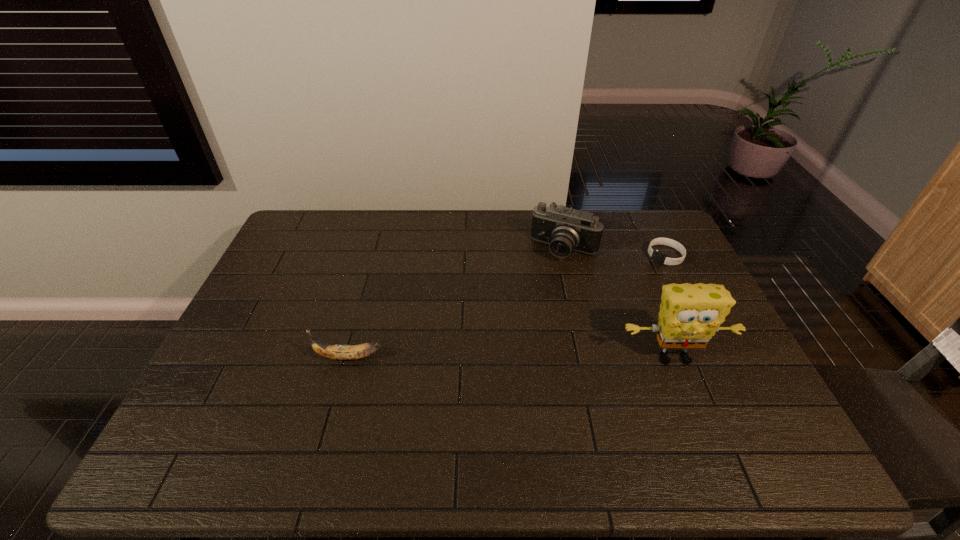
This screenshot has width=960, height=540. I want to click on vacant space at the near edge of the desktop, so click(630, 413).

The width and height of the screenshot is (960, 540). In the image, there is a desktop. What are the coordinates of `vacant space at the left edge` in the screenshot? It's located at coord(241,345).

In the image, there is a desktop. Where is `vacant space at the far left corner`? This screenshot has height=540, width=960. vacant space at the far left corner is located at coordinates (303, 233).

Identify the location of free region at the far right corner of the desktop. The image size is (960, 540). (638, 230).

I want to click on vacant space at the near right corner, so click(767, 414).

This screenshot has height=540, width=960. Identify the location of vacant point located between the second shortest object and the wristband. (507, 307).

You are a GUI agent. You are given a task and a screenshot of the screen. Output one action in this format:
    pyautogui.click(x=<x>, y=<y>)
    Task: Click on the free space that is in between the second tallest object and the shortest object
    
    Given the screenshot: What is the action you would take?
    pyautogui.click(x=614, y=253)

Locate an element on the screen. free spot between the banana and the sponge is located at coordinates (511, 357).

At what (x,y) coordinates should I click in order to perform the action: click on vacant area that lies between the banana and the camera. Please return your answer as a coordinate pair (x, y). Looking at the image, I should click on (457, 303).

Locate an element on the screen. The height and width of the screenshot is (540, 960). blank region between the camera and the tallest object is located at coordinates (619, 303).